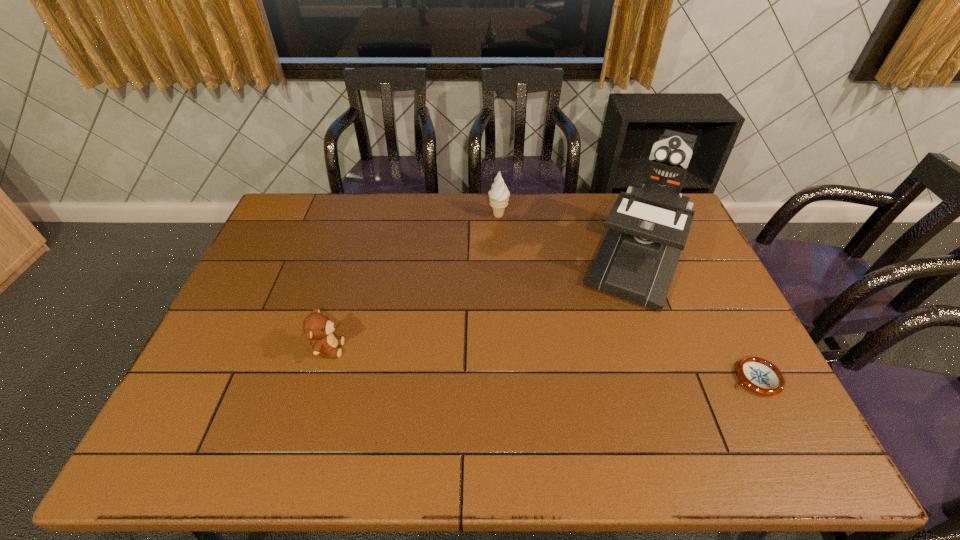
This screenshot has width=960, height=540. I want to click on vacant space on the desktop that is between the leftmost object and the compass and is positioned on the front-facing side of the icecream, so click(x=584, y=366).

This screenshot has height=540, width=960. I want to click on vacant space on the desktop that is between the second shortest object and the compass and is positioned through the eyepieces of the microscope, so click(593, 367).